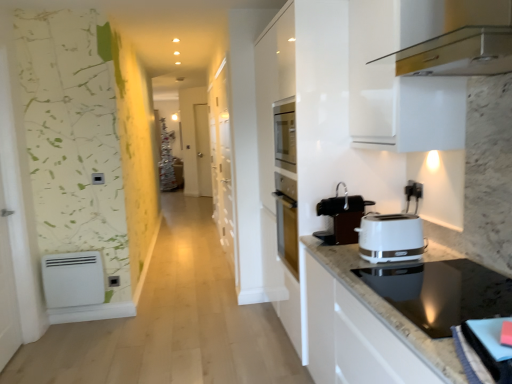
Question: From the image's perspective, does black plastic electric outlet at lower left, positioned as the 1th electric outlet in bottom-to-top order, appear higher than metallic gold range hood at upper right, the first home appliance positioned from the top?

Choices:
 (A) yes
 (B) no

Answer: (B)

Question: Considering the relative sizes of black plastic electric outlet at lower left, the 2th electric outlet viewed from the right, and metallic gold range hood at upper right, the first home appliance positioned from the top, in the image provided, is black plastic electric outlet at lower left, the 2th electric outlet viewed from the right, thinner than metallic gold range hood at upper right, the first home appliance positioned from the top,?

Choices:
 (A) yes
 (B) no

Answer: (A)

Question: Could you tell me if black plastic electric outlet at lower left, the first electric outlet when ordered from left to right, is turned towards metallic gold range hood at upper right, the second home appliance in the bottom-to-top sequence?

Choices:
 (A) yes
 (B) no

Answer: (B)

Question: Is black plastic electric outlet at lower left, the 2th electric outlet viewed from the right, at the left side of metallic gold range hood at upper right, the second home appliance in the bottom-to-top sequence?

Choices:
 (A) yes
 (B) no

Answer: (A)

Question: Considering the relative positions of black plastic electric outlet at lower left, placed as the 1th electric outlet when sorted from back to front, and metallic gold range hood at upper right, the first home appliance positioned from the top, in the image provided, is black plastic electric outlet at lower left, placed as the 1th electric outlet when sorted from back to front, to the right of metallic gold range hood at upper right, the first home appliance positioned from the top, from the viewer's perspective?

Choices:
 (A) no
 (B) yes

Answer: (A)

Question: Is white matte heater at lower left wider or thinner than black plastic electric outlet at lower left, placed as the 1th electric outlet when sorted from back to front?

Choices:
 (A) wide
 (B) thin

Answer: (A)

Question: From a real-world perspective, is white matte heater at lower left physically located above or below black plastic electric outlet at lower left, placed as the 2th electric outlet when sorted from front to back?

Choices:
 (A) below
 (B) above

Answer: (B)

Question: Is white matte heater at lower left taller or shorter than black plastic electric outlet at lower left, placed as the 2th electric outlet when sorted from front to back?

Choices:
 (A) tall
 (B) short

Answer: (A)

Question: Is white matte heater at lower left in front of or behind black plastic electric outlet at lower left, positioned as the 1th electric outlet in bottom-to-top order, in the image?

Choices:
 (A) front
 (B) behind

Answer: (A)

Question: Is white matte heater at lower left taller or shorter than black plastic electric outlet at upper right, the 1th electric outlet when ordered from right to left?

Choices:
 (A) tall
 (B) short

Answer: (A)

Question: In terms of size, does white matte heater at lower left appear bigger or smaller than black plastic electric outlet at upper right, marked as the 2th electric outlet in a left-to-right arrangement?

Choices:
 (A) small
 (B) big

Answer: (B)

Question: Is white matte heater at lower left wider or thinner than black plastic electric outlet at upper right, the second electric outlet in the back-to-front sequence?

Choices:
 (A) thin
 (B) wide

Answer: (B)

Question: From a real-world perspective, is white matte heater at lower left physically located above or below black plastic electric outlet at upper right, the 1th electric outlet when ordered from right to left?

Choices:
 (A) below
 (B) above

Answer: (A)

Question: In terms of height, does black plastic electric outlet at lower left, the 2th electric outlet viewed from the right, look taller or shorter compared to metallic gold range hood at upper right, the first home appliance positioned from the top?

Choices:
 (A) tall
 (B) short

Answer: (B)

Question: In the image, is black plastic electric outlet at lower left, positioned as the 1th electric outlet in bottom-to-top order, on the left side or the right side of metallic gold range hood at upper right, the first home appliance positioned from the top?

Choices:
 (A) left
 (B) right

Answer: (A)